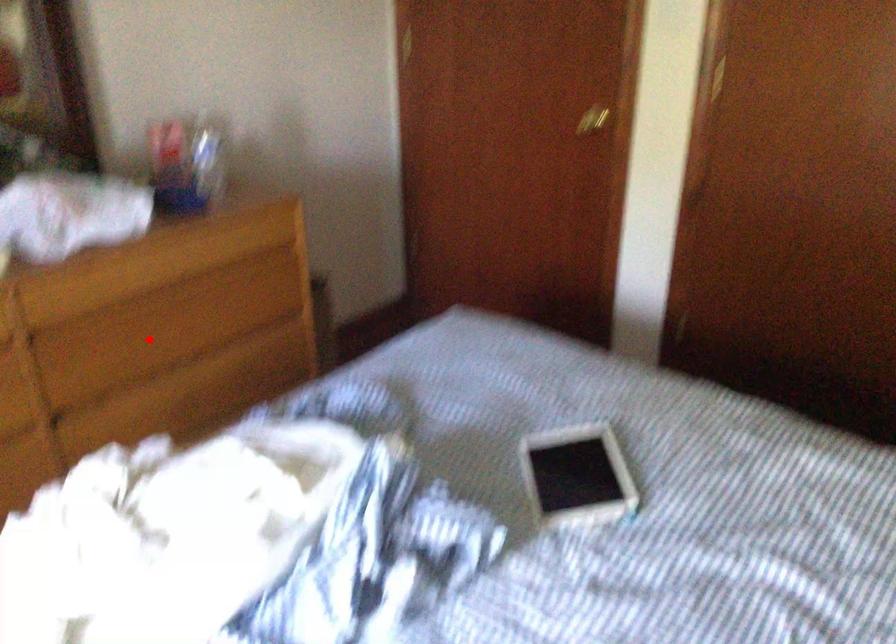
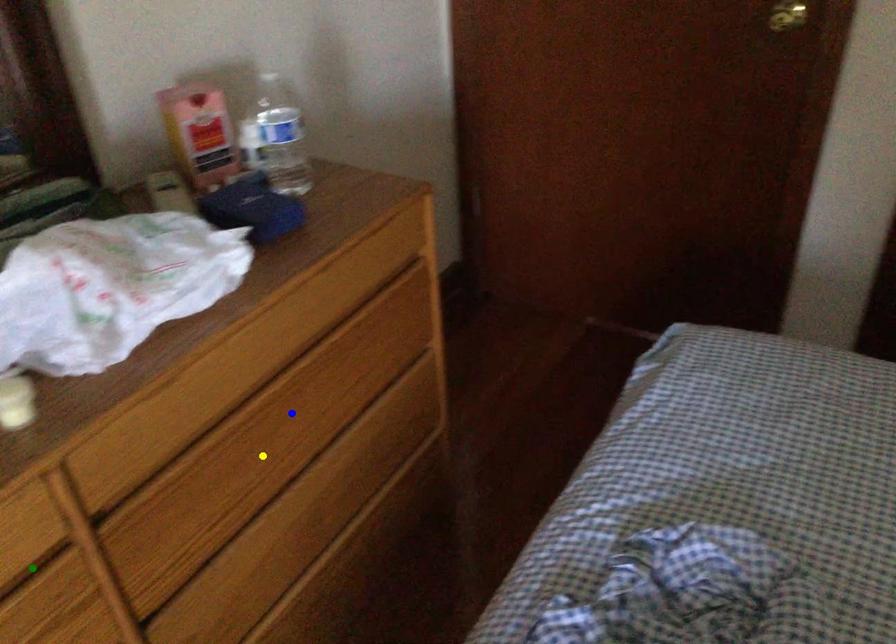
Question: I am providing you with two images of the same scene from different viewpoints. A red point is marked on the first image. You are given multiple points on the second image. Which spot in image 2 lines up with the point in image 1?

Choices:
 (A) yellow point
 (B) blue point
 (C) green point

Answer: (A)